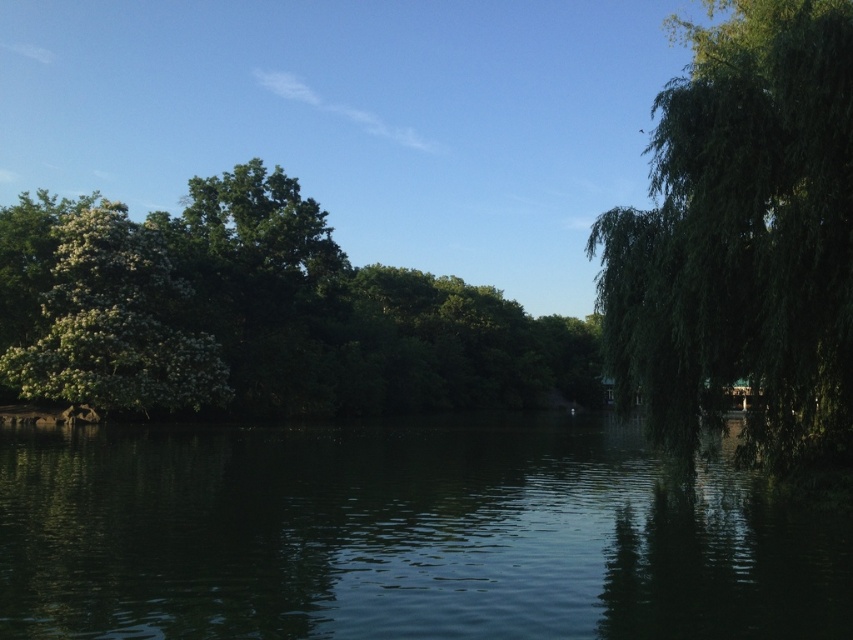
What are the coordinates of `green leafy tree at left` in the screenshot? It's located at (257, 314).

Is green leafy tree at left taller than green leafy tree at right?

In fact, green leafy tree at left may be shorter than green leafy tree at right.

Between point (309, 237) and point (808, 29), which one is positioned behind?

The point (309, 237) is more distant.

Find the location of a particular element. The width and height of the screenshot is (853, 640). green leafy tree at left is located at coordinates (257, 314).

Is green smooth water at center wider than green leafy tree at left?

No.

Which of these two, green smooth water at center or green leafy tree at left, stands taller?

green leafy tree at left

Measure the distance between green smooth water at center and camera.

They are 9.09 meters apart.

Where is `green smooth water at center`? green smooth water at center is located at coordinates (401, 536).

Who is more forward, (740, 492) or (167, 353)?

Point (740, 492)

Who is positioned more to the right, green smooth water at center or white fluffy tree at left?

green smooth water at center is more to the right.

Between point (560, 572) and point (59, 291), which one is positioned in front?

Point (560, 572)

This screenshot has width=853, height=640. What are the coordinates of `green smooth water at center` in the screenshot? It's located at (401, 536).